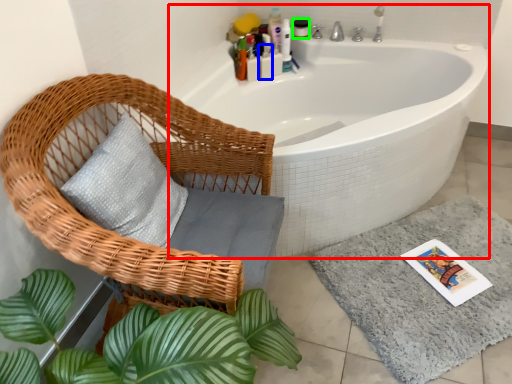
Question: Considering the real-world distances, which object is closest to bathtub (highlighted by a red box)? toiletry (highlighted by a blue box) or toiletry (highlighted by a green box).

Choices:
 (A) toiletry
 (B) toiletry

Answer: (A)